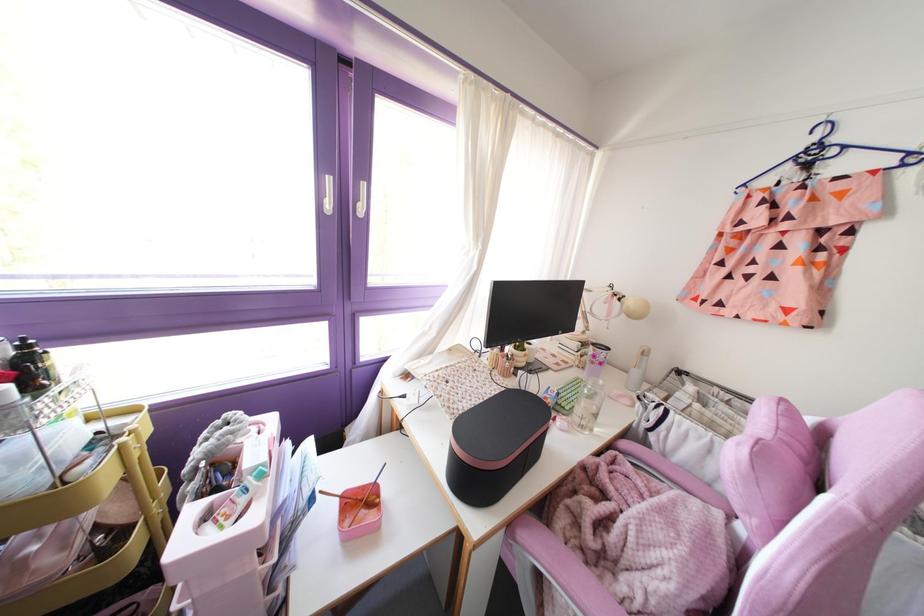
Image resolution: width=924 pixels, height=616 pixels. Identify the location of white bottle. (638, 369).